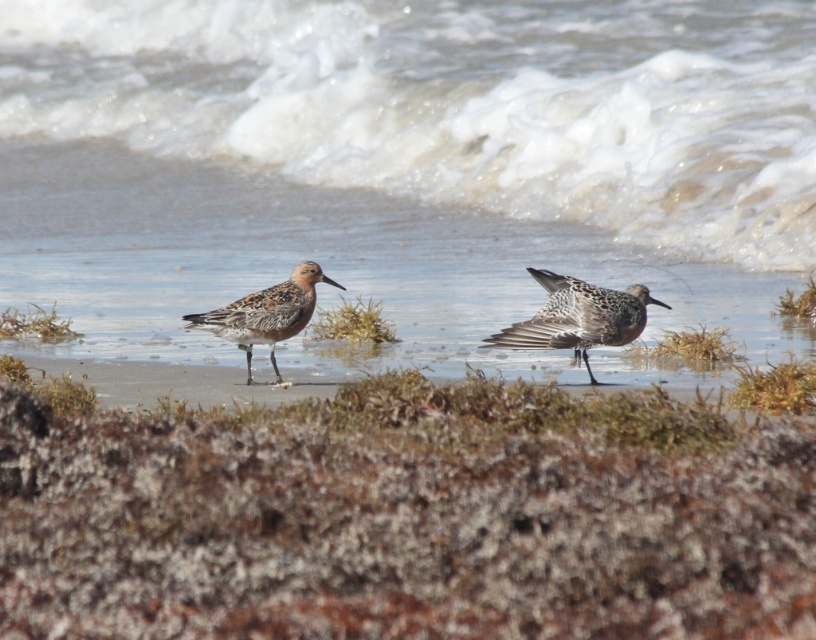
Is brown speckled feathers at center smaller than brown speckled sandpiper at center?

No, brown speckled feathers at center is not smaller than brown speckled sandpiper at center.

Does brown speckled feathers at center have a lesser width compared to brown speckled sandpiper at center?

No.

The image size is (816, 640). What are the coordinates of `brown speckled feathers at center` in the screenshot? It's located at (579, 317).

At what (x,y) coordinates should I click in order to perform the action: click on brown speckled feathers at center. Please return your answer as a coordinate pair (x, y). Looking at the image, I should click on (579, 317).

Between point (710, 112) and point (256, 294), which one is positioned in front?

Point (256, 294)

Is the position of white frothy water at center less distant than that of brown speckled sandpiper at center?

That is False.

Measure the distance between white frothy water at center and camera.

white frothy water at center and camera are 9.11 meters apart.

Image resolution: width=816 pixels, height=640 pixels. In order to click on white frothy water at center in this screenshot , I will do `click(457, 104)`.

Is point (247, 141) positioned after point (548, 278)?

Yes, it is.

Who is positioned more to the left, white frothy water at center or brown speckled feathers at center?

Positioned to the left is white frothy water at center.

The width and height of the screenshot is (816, 640). What are the coordinates of `white frothy water at center` in the screenshot? It's located at (457, 104).

This screenshot has width=816, height=640. I want to click on white frothy water at center, so click(457, 104).